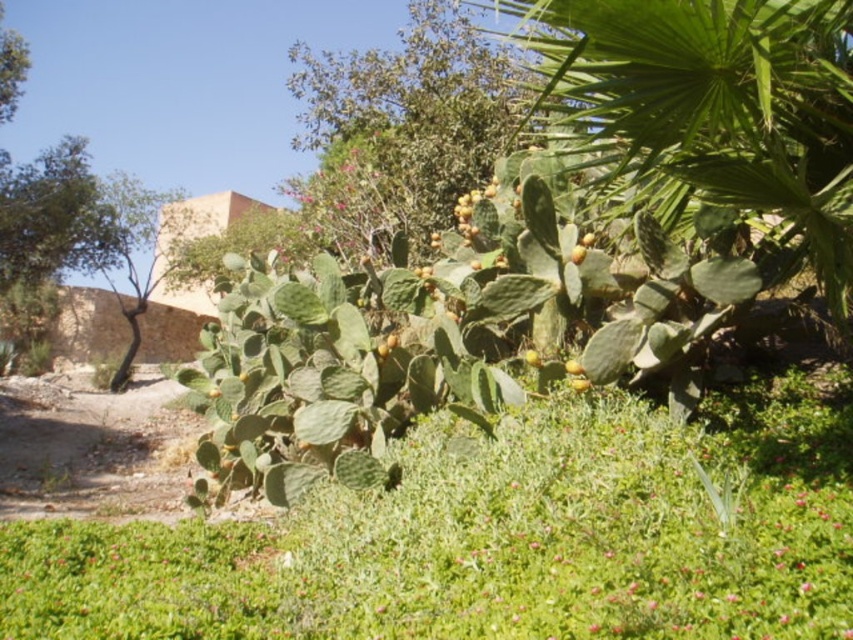
Is green leafy palm at upper right thinner than yellow matte fruit at center?

No.

Which is behind, point (605, 108) or point (581, 259)?

Positioned behind is point (581, 259).

You are a GUI agent. You are given a task and a screenshot of the screen. Output one action in this format:
    pyautogui.click(x=<x>, y=<y>)
    Task: Click on the green leafy palm at upper right
    This screenshot has height=640, width=853.
    Given the screenshot: What is the action you would take?
    pyautogui.click(x=711, y=115)

Which is more to the right, green leafy grass at center or green leafy palm at upper right?

From the viewer's perspective, green leafy palm at upper right appears more on the right side.

Does point (552, 538) lie in front of point (758, 29)?

No, it is not.

Between point (708, 419) and point (596, 144), which one is positioned in front?

Positioned in front is point (596, 144).

Identify the location of green leafy grass at center. The width and height of the screenshot is (853, 640). (498, 538).

Can you confirm if green leafy grass at center is positioned to the right of green spiny cactus at center?

Yes, green leafy grass at center is to the right of green spiny cactus at center.

Between green leafy grass at center and green spiny cactus at center, which one is positioned lower?

green leafy grass at center is below.

Between point (546, 616) and point (314, 204), which one is positioned behind?

Positioned behind is point (314, 204).

The height and width of the screenshot is (640, 853). What are the coordinates of `green leafy grass at center` in the screenshot? It's located at (498, 538).